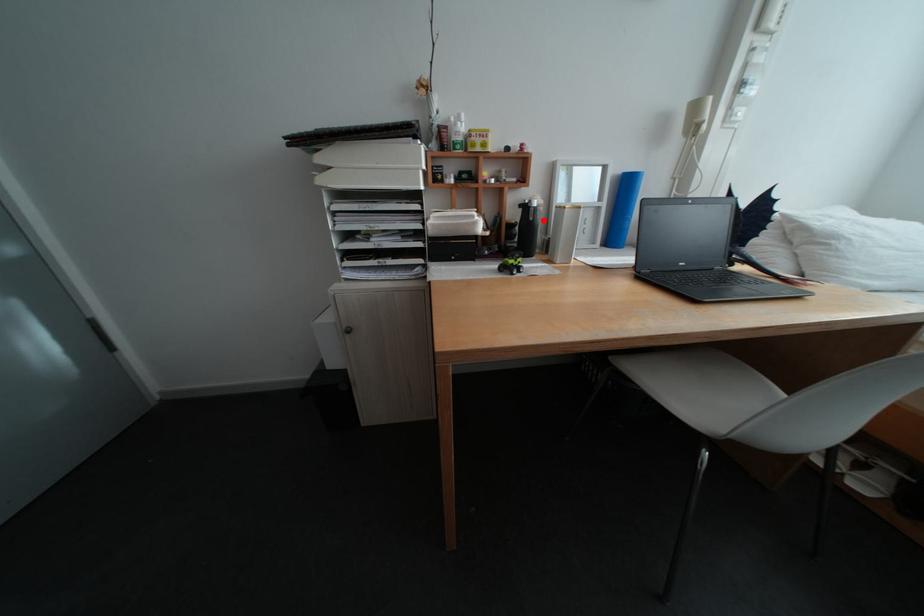
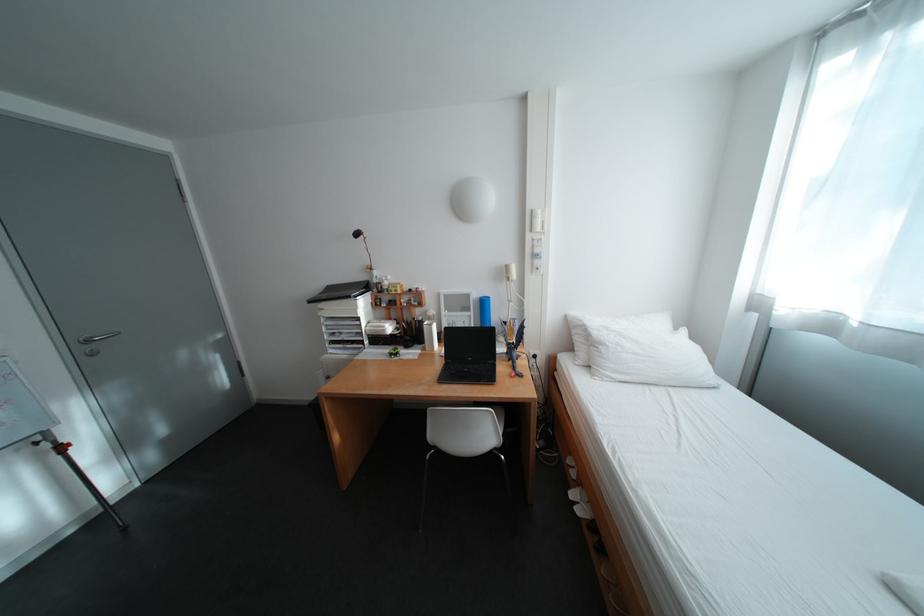
Question: I am providing you with two images of the same scene from different viewpoints. A red point is marked on the first image. Is the red point's position out of view in image 2?

Choices:
 (A) Yes
 (B) No

Answer: (B)